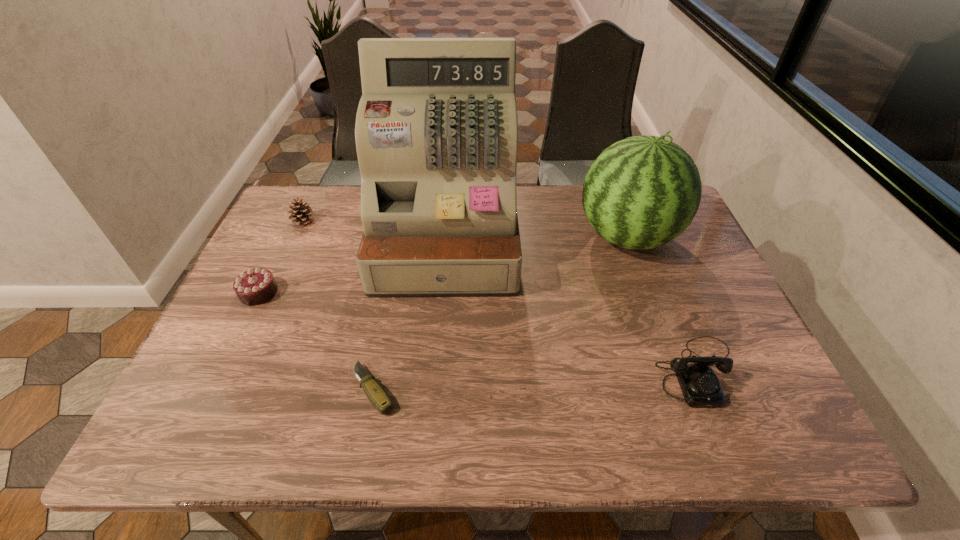
Where is `vacant space situated on the right of the shortest object`? The image size is (960, 540). vacant space situated on the right of the shortest object is located at coordinates (553, 389).

Locate an element on the screen. cash register that is at the far edge is located at coordinates (436, 131).

At what (x,y) coordinates should I click in order to perform the action: click on watermelon present at the far edge. Please return your answer as a coordinate pair (x, y). The height and width of the screenshot is (540, 960). Looking at the image, I should click on (642, 192).

Locate an element on the screen. pinecone at the far edge is located at coordinates (302, 213).

Find the location of a particular element. telephone that is positioned at the near edge is located at coordinates (700, 386).

Find the location of `pocketknife situated at the near edge`. pocketknife situated at the near edge is located at coordinates (375, 393).

In order to click on pinecone that is at the left edge in this screenshot , I will do `click(302, 213)`.

Find the location of a particular element. This screenshot has height=540, width=960. chocolate cake located at the left edge is located at coordinates (255, 286).

This screenshot has width=960, height=540. Find the location of `watermelon positioned at the right edge`. watermelon positioned at the right edge is located at coordinates (642, 192).

Find the location of a particular element. telephone that is at the right edge is located at coordinates (700, 386).